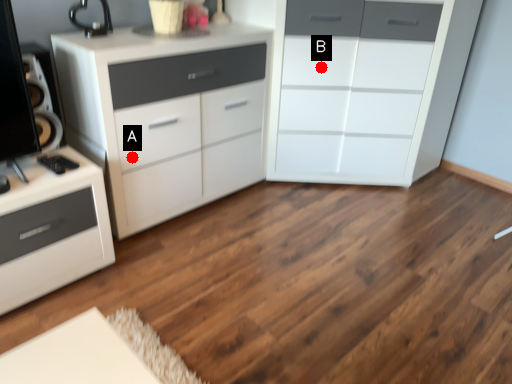
Question: Two points are circled on the image, labeled by A and B beside each circle. Which point is farther to the camera?

Choices:
 (A) A is further
 (B) B is further

Answer: (B)